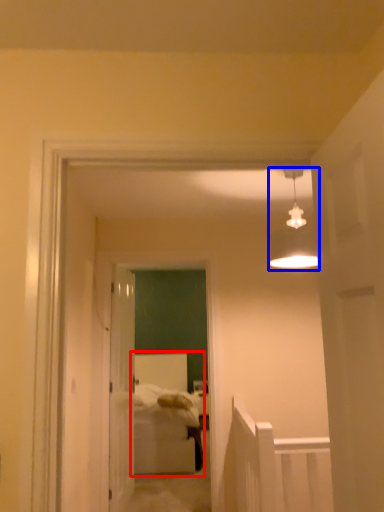
Question: Among these objects, which one is farthest to the camera, bed (highlighted by a red box) or light fixture (highlighted by a blue box)?

Choices:
 (A) bed
 (B) light fixture

Answer: (A)